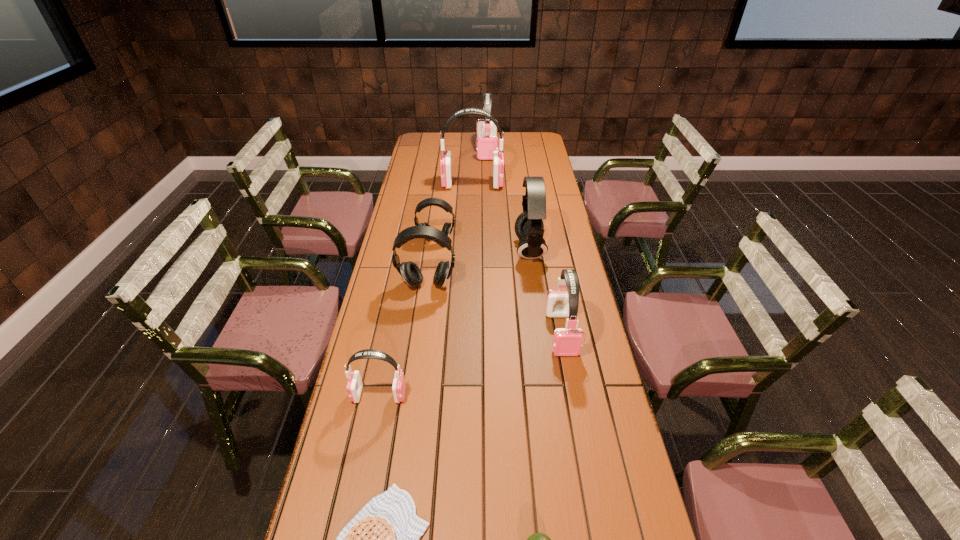
Where is `the eighth nearest object`? the eighth nearest object is located at coordinates (446, 159).

Locate an element on the screen. This screenshot has height=540, width=960. the tallest object is located at coordinates (446, 159).

Locate an element on the screen. This screenshot has width=960, height=540. the third smallest pink earphone is located at coordinates (487, 141).

Identify the location of the farthest earphone. This screenshot has height=540, width=960. (487, 141).

Where is `the biggest black earphone`? This screenshot has width=960, height=540. the biggest black earphone is located at coordinates (529, 227).

The image size is (960, 540). I want to click on the fifth nearest object, so click(x=411, y=273).

Find the location of a particular element. This screenshot has width=960, height=540. the second smallest black earphone is located at coordinates [411, 273].

Image resolution: width=960 pixels, height=540 pixels. I want to click on the second nearest earphone, so click(567, 341).

Find the location of `the sixth farthest object`. the sixth farthest object is located at coordinates (567, 341).

The image size is (960, 540). Identify the location of the smallest black earphone. click(447, 229).